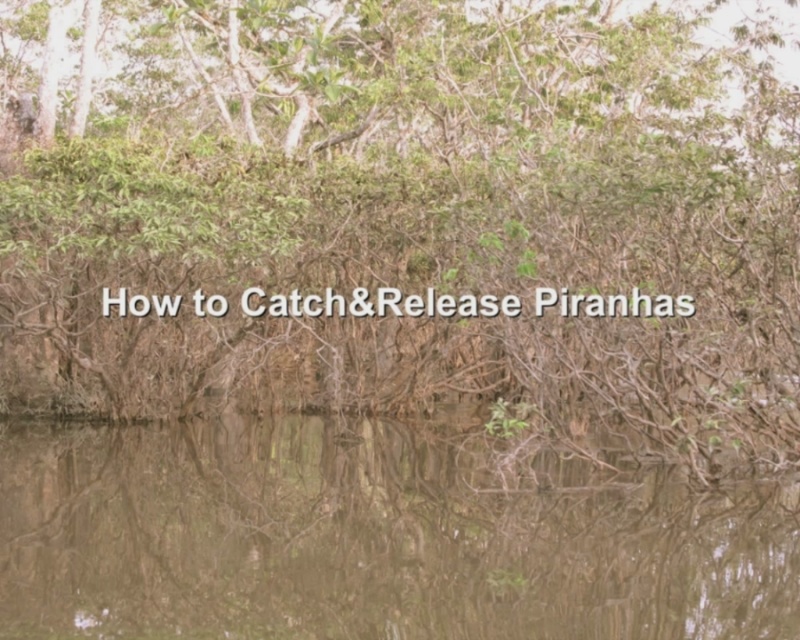
Question: Does green leafy tree at center have a smaller size compared to brown murky water at center?

Choices:
 (A) no
 (B) yes

Answer: (A)

Question: Is green leafy tree at center bigger than brown murky water at center?

Choices:
 (A) yes
 (B) no

Answer: (A)

Question: Which point is closer to the camera?

Choices:
 (A) brown murky water at center
 (B) green leafy tree at center

Answer: (A)

Question: Can you confirm if green leafy tree at center is positioned below brown murky water at center?

Choices:
 (A) no
 (B) yes

Answer: (A)

Question: Which point is farther from the camera taking this photo?

Choices:
 (A) (600, 250)
 (B) (380, 461)

Answer: (B)